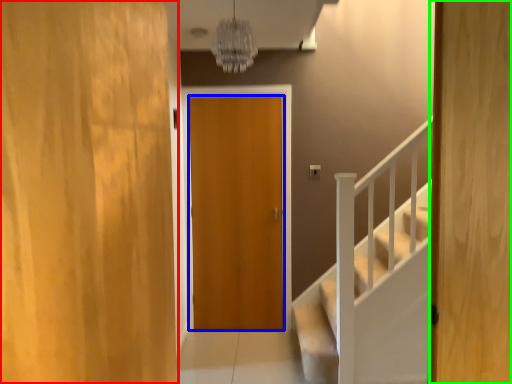
Question: Which object is the closest to the door (highlighted by a red box)? Choose among these: door (highlighted by a blue box) or door (highlighted by a green box).

Choices:
 (A) door
 (B) door

Answer: (B)